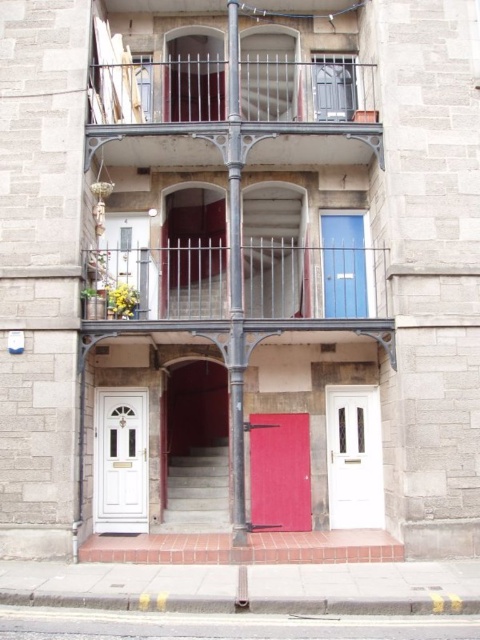
Question: Considering the real-world distances, which object is closest to the metallic wrought iron balcony at upper center?

Choices:
 (A) white glossy door at lower left
 (B) metallic railing at upper center
 (C) blue matte door at center
 (D) white glass door at center

Answer: (B)

Question: Is white glossy door at lower left positioned in front of blue matte door at center?

Choices:
 (A) yes
 (B) no

Answer: (A)

Question: Does white glass door at center appear on the right side of blue matte door at center?

Choices:
 (A) yes
 (B) no

Answer: (A)

Question: Which point is closer to the camera?

Choices:
 (A) metallic railing at upper center
 (B) blue matte door at center

Answer: (B)

Question: Can you confirm if metallic wrought iron balcony at upper center is thinner than white glass door at center?

Choices:
 (A) yes
 (B) no

Answer: (B)

Question: Which of these objects is positioned farthest from the matte red door at center?

Choices:
 (A) white glossy door at lower left
 (B) metallic wrought iron balcony at upper center

Answer: (B)